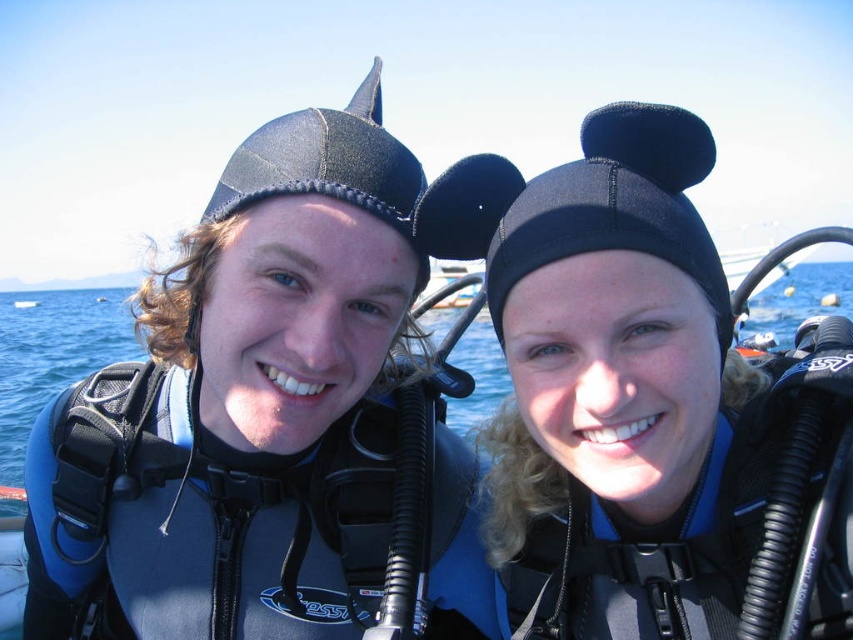
Question: Can you confirm if black neoprene swim cap at center is positioned below blue matte water at center?

Choices:
 (A) yes
 (B) no

Answer: (A)

Question: Which point is closer to the camera taking this photo?

Choices:
 (A) (4, 296)
 (B) (772, 596)

Answer: (B)

Question: Does black neoprene swim cap at center have a larger size compared to blue matte water at center?

Choices:
 (A) no
 (B) yes

Answer: (A)

Question: Is black neoprene swim cap at center below blue matte water at center?

Choices:
 (A) yes
 (B) no

Answer: (A)

Question: Which object is closer to the camera taking this photo?

Choices:
 (A) black neoprene swim cap at center
 (B) blue matte water at center

Answer: (A)